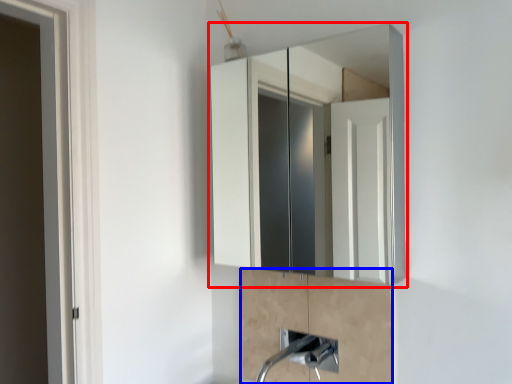
Question: Which object is further to the camera taking this photo, medicine cabinet (highlighted by a red box) or cabinetry (highlighted by a blue box)?

Choices:
 (A) medicine cabinet
 (B) cabinetry

Answer: (B)